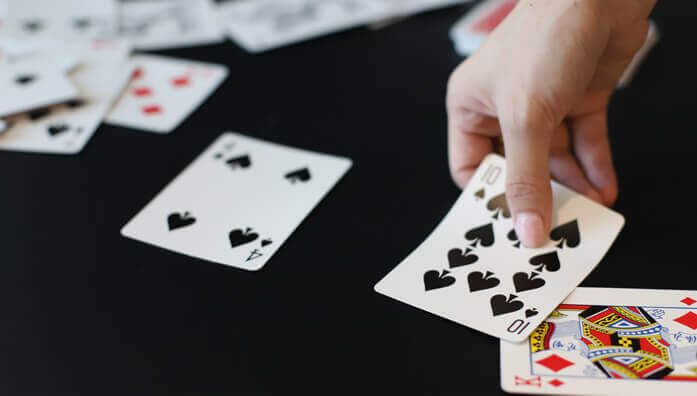
Where is `black counter top`? The width and height of the screenshot is (697, 396). black counter top is located at coordinates (306, 287).